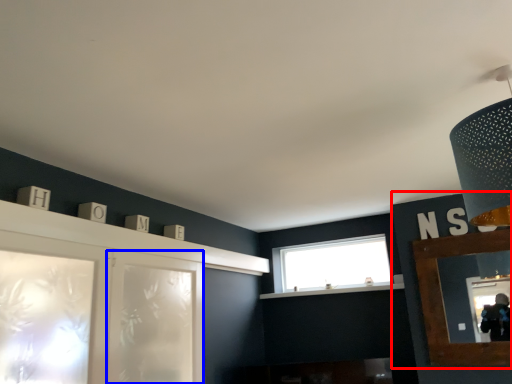
Question: Among these objects, which one is farthest to the camera, cabinetry (highlighted by a red box) or screen door (highlighted by a blue box)?

Choices:
 (A) cabinetry
 (B) screen door

Answer: (A)